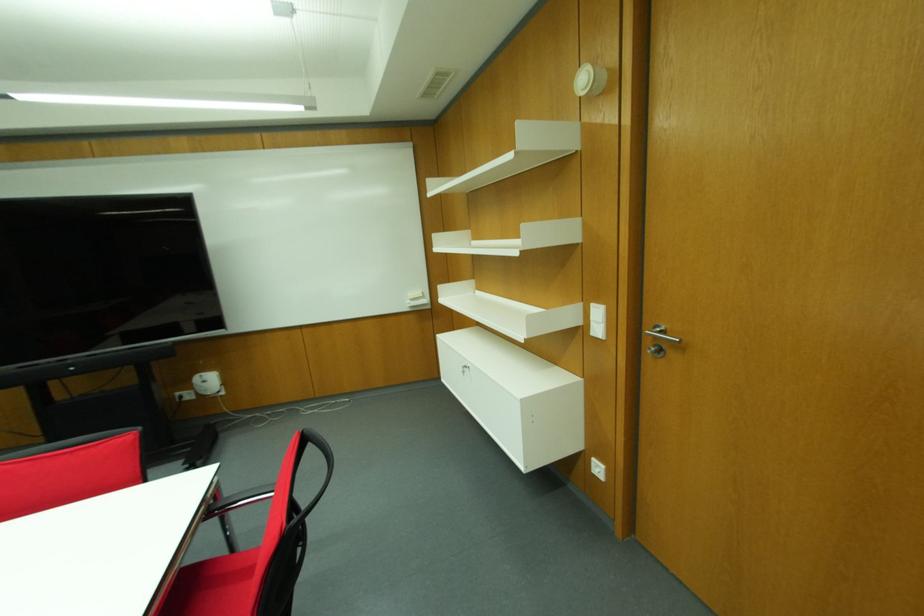
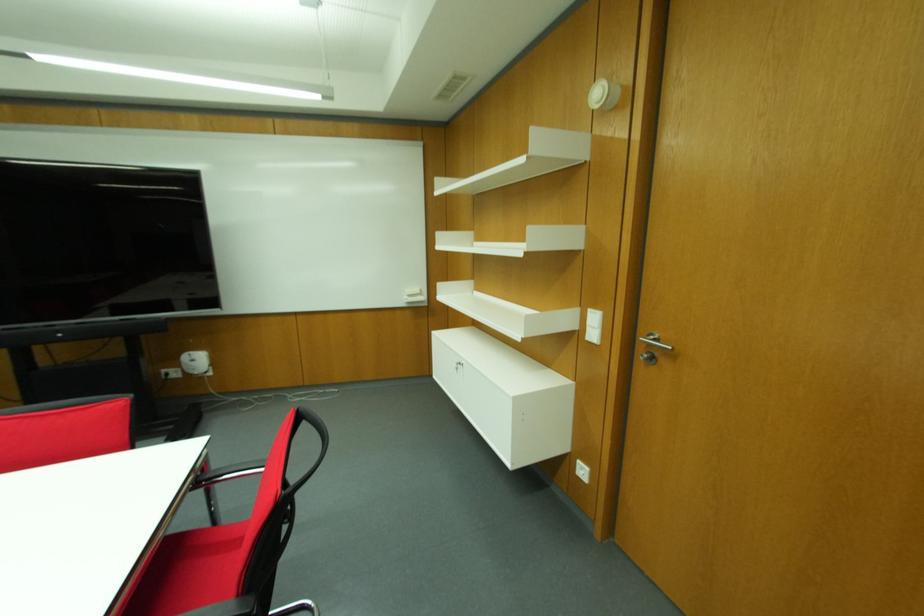
Locate, in the second image, the point that corresponds to the point at 418,293 in the first image.

(416, 291)